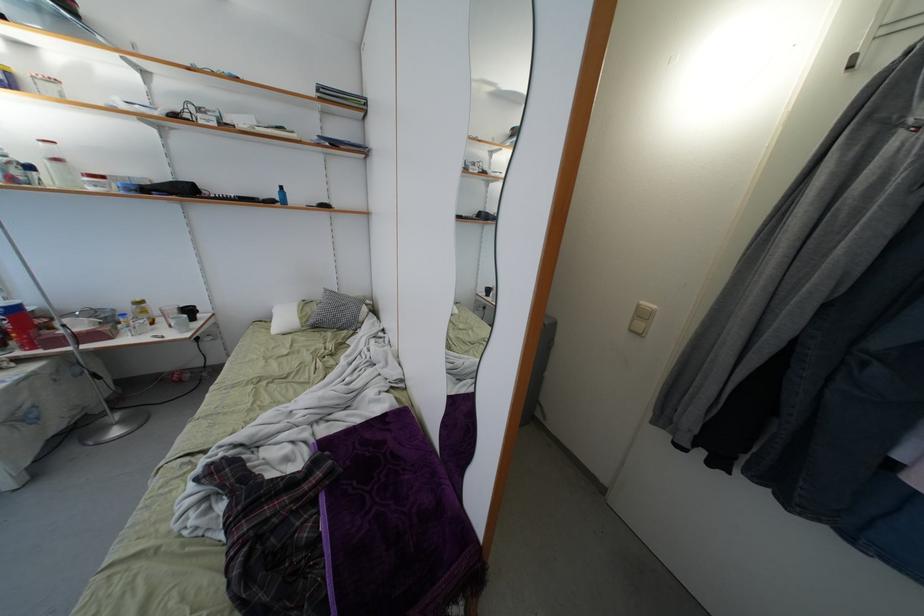
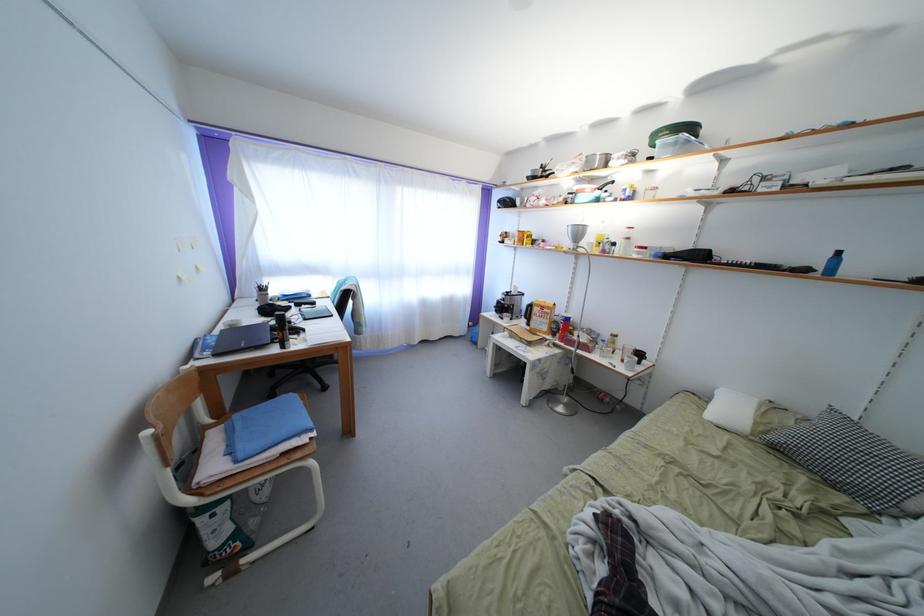
Question: The camera is either moving clockwise (left) or counter-clockwise (right) around the object. The first image is from the beginning of the video and the second image is from the end. Is the camera moving left or right when shooting the video?

Choices:
 (A) Left
 (B) Right

Answer: (B)